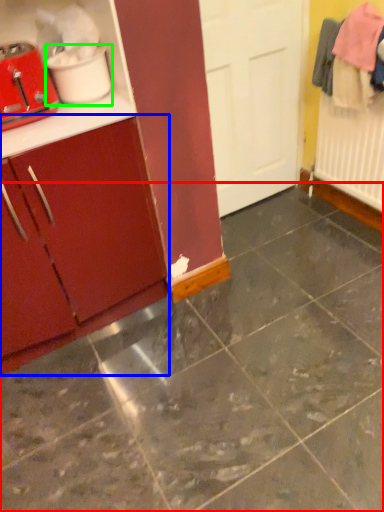
Question: Which is farther away from concrete (highlighted by a red box)? cabinetry (highlighted by a blue box) or appliance (highlighted by a green box)?

Choices:
 (A) cabinetry
 (B) appliance

Answer: (B)